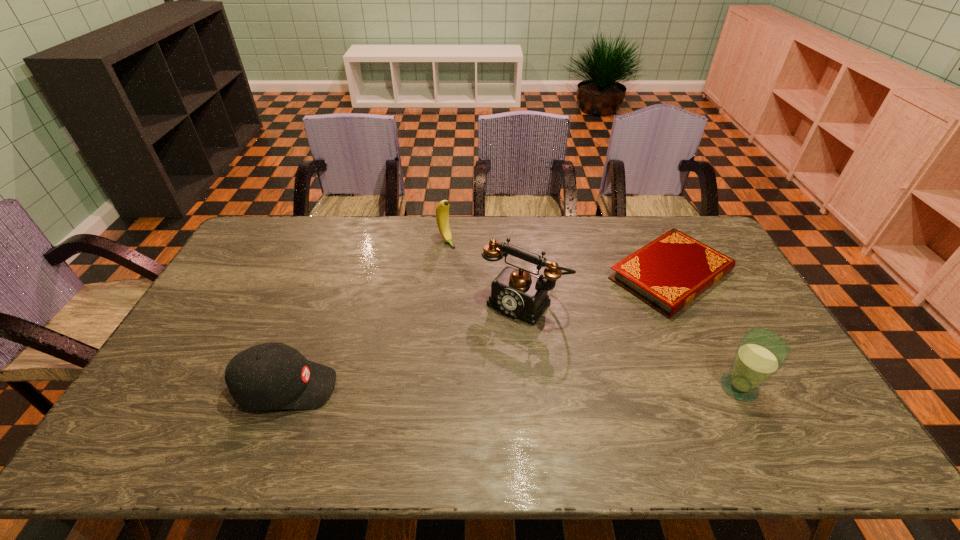
You are a GUI agent. You are given a task and a screenshot of the screen. Output one action in this format:
    pyautogui.click(x=<x>, y=<y>)
    Task: Click on the vacant space on the desktop that is between the baseball cap and the glass and is positioned on the front of the tallest object at the rotary dial
    The width and height of the screenshot is (960, 540).
    Given the screenshot: What is the action you would take?
    pyautogui.click(x=458, y=388)

Locate an element on the screen. The height and width of the screenshot is (540, 960). vacant spot on the desktop that is between the baseball cap and the glass and is positioned from the stem of the second object from left to right is located at coordinates (580, 388).

The height and width of the screenshot is (540, 960). Identify the location of vacant space on the desktop that is between the leftmost object and the glass and is positioned on the cover of the shortest object. (508, 388).